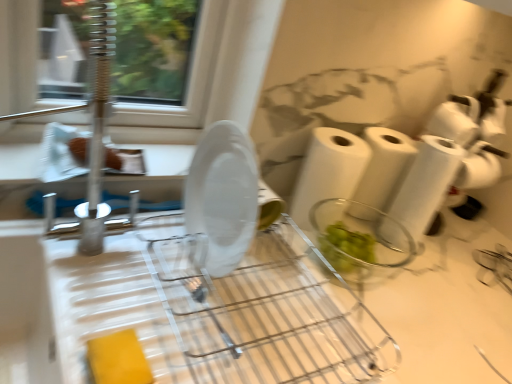
Locate an element on the screen. The image size is (512, 384). white paper towel at center, the 2th paper towel in the left-to-right sequence is located at coordinates (384, 166).

Image resolution: width=512 pixels, height=384 pixels. Describe the element at coordinates (384, 166) in the screenshot. I see `white paper towel at center, which is counted as the 1th paper towel, starting from the right` at that location.

In order to click on white paper towel at right, which ranks as the 2th toilet paper in top-to-bottom order in this screenshot , I will do `click(474, 132)`.

The width and height of the screenshot is (512, 384). What do you see at coordinates (455, 120) in the screenshot?
I see `white matte toilet paper at upper right, the fourth toilet paper ordered from the bottom` at bounding box center [455, 120].

Identify the location of transparent plastic plate at center. The height and width of the screenshot is (384, 512). (219, 290).

This screenshot has width=512, height=384. Describe the element at coordinates (426, 184) in the screenshot. I see `white matte toilet paper at center, marked as the 4th toilet paper in a top-to-bottom arrangement` at that location.

What is the approximate width of white matte toilet paper at center, the first toilet paper positioned from the bottom?

The width of white matte toilet paper at center, the first toilet paper positioned from the bottom, is 11.65 centimeters.

Identify the location of white paper towel at center, placed as the first paper towel when sorted from left to right. The height and width of the screenshot is (384, 512). (328, 171).

Can you tell me how much white matte toilet paper at upper right, the first toilet paper when ordered from top to bottom, and white paper towel at right, arranged as the third toilet paper when ordered from the bottom, differ in facing direction?

43.3 degrees separate the facing orientations of white matte toilet paper at upper right, the first toilet paper when ordered from top to bottom, and white paper towel at right, arranged as the third toilet paper when ordered from the bottom.

The width and height of the screenshot is (512, 384). I want to click on the 1st toilet paper to the right of the white matte toilet paper at upper right, the first toilet paper when ordered from top to bottom, starting your count from the anchor, so click(x=474, y=132).

Is white matte toilet paper at upper right, the first toilet paper when ordered from top to bottom, oriented away from white paper towel at right, which ranks as the 2th toilet paper in top-to-bottom order?

Yes, white matte toilet paper at upper right, the first toilet paper when ordered from top to bottom,'s orientation is away from white paper towel at right, which ranks as the 2th toilet paper in top-to-bottom order.

Does white matte toilet paper at right, which is counted as the 3th toilet paper, starting from the top, have a lesser width compared to white paper towel at center, the 2th paper towel in the left-to-right sequence?

Indeed, white matte toilet paper at right, which is counted as the 3th toilet paper, starting from the top, has a lesser width compared to white paper towel at center, the 2th paper towel in the left-to-right sequence.

From the picture: Is white matte toilet paper at right, which is counted as the second toilet paper, starting from the bottom, to the left or to the right of white paper towel at center, which is counted as the 1th paper towel, starting from the right, in the image?

white matte toilet paper at right, which is counted as the second toilet paper, starting from the bottom, is positioned on white paper towel at center, which is counted as the 1th paper towel, starting from the right,'s right side.

From the image's perspective, who appears lower, white matte toilet paper at right, which is counted as the 3th toilet paper, starting from the top, or white paper towel at center, which is counted as the 1th paper towel, starting from the right?

white paper towel at center, which is counted as the 1th paper towel, starting from the right, is shown below in the image.

Is white matte toilet paper at right, which is counted as the 3th toilet paper, starting from the top, looking in the opposite direction of white paper towel at center, which is counted as the 1th paper towel, starting from the right?

No, white matte toilet paper at right, which is counted as the 3th toilet paper, starting from the top,'s orientation is not away from white paper towel at center, which is counted as the 1th paper towel, starting from the right.

Would you say white matte toilet paper at upper right, the first toilet paper when ordered from top to bottom, is outside white matte toilet paper at right, which is counted as the 3th toilet paper, starting from the top?

Yes.

From the picture: Which is farther, (460, 140) or (479, 185)?

The point (479, 185) is more distant.

From the image's perspective, would you say white matte toilet paper at upper right, the first toilet paper when ordered from top to bottom, is positioned over white matte toilet paper at right, which is counted as the second toilet paper, starting from the bottom?

Yes, from the image's perspective, white matte toilet paper at upper right, the first toilet paper when ordered from top to bottom, is on top of white matte toilet paper at right, which is counted as the second toilet paper, starting from the bottom.

Does white matte toilet paper at upper right, the first toilet paper when ordered from top to bottom, touch white matte toilet paper at right, which is counted as the second toilet paper, starting from the bottom?

There is a gap between white matte toilet paper at upper right, the first toilet paper when ordered from top to bottom, and white matte toilet paper at right, which is counted as the second toilet paper, starting from the bottom.

Is white matte toilet paper at center, the first toilet paper positioned from the bottom, aimed at white paper towel at center, which is counted as the 1th paper towel, starting from the right?

No, white matte toilet paper at center, the first toilet paper positioned from the bottom, is not facing towards white paper towel at center, which is counted as the 1th paper towel, starting from the right.

Is white matte toilet paper at center, marked as the 4th toilet paper in a top-to-bottom arrangement, positioned before white paper towel at center, which is counted as the 1th paper towel, starting from the right?

Yes, it is in front of white paper towel at center, which is counted as the 1th paper towel, starting from the right.

Could you measure the distance between white matte toilet paper at center, the first toilet paper positioned from the bottom, and white paper towel at center, the 2th paper towel in the left-to-right sequence?

They are 2.83 inches apart.

Is white matte toilet paper at center, the first toilet paper positioned from the bottom, to the left of white paper towel at center, which is counted as the 1th paper towel, starting from the right, from the viewer's perspective?

In fact, white matte toilet paper at center, the first toilet paper positioned from the bottom, is to the right of white paper towel at center, which is counted as the 1th paper towel, starting from the right.

From a real-world perspective, does white paper towel at right, arranged as the third toilet paper when ordered from the bottom, stand above white paper towel at center, which is the 2th paper towel in right-to-left order?

Yes, from a real-world perspective, white paper towel at right, arranged as the third toilet paper when ordered from the bottom, is over white paper towel at center, which is the 2th paper towel in right-to-left order

Which of these two, white paper towel at right, which ranks as the 2th toilet paper in top-to-bottom order, or white paper towel at center, placed as the first paper towel when sorted from left to right, is thinner?

white paper towel at center, placed as the first paper towel when sorted from left to right.

From the image's perspective, would you say white paper towel at right, which ranks as the 2th toilet paper in top-to-bottom order, is shown under white paper towel at center, which is the 2th paper towel in right-to-left order?

Incorrect, from the image's perspective, white paper towel at right, which ranks as the 2th toilet paper in top-to-bottom order, is higher than white paper towel at center, which is the 2th paper towel in right-to-left order.

Is the depth of white paper towel at right, which ranks as the 2th toilet paper in top-to-bottom order, less than that of white paper towel at center, placed as the first paper towel when sorted from left to right?

No, the depth of white paper towel at right, which ranks as the 2th toilet paper in top-to-bottom order, is greater than that of white paper towel at center, placed as the first paper towel when sorted from left to right.

Considering the sizes of objects white paper towel at center, placed as the first paper towel when sorted from left to right, and white matte toilet paper at upper right, the fourth toilet paper ordered from the bottom, in the image provided, who is wider, white paper towel at center, placed as the first paper towel when sorted from left to right, or white matte toilet paper at upper right, the fourth toilet paper ordered from the bottom,?

Wider between the two is white matte toilet paper at upper right, the fourth toilet paper ordered from the bottom.

Is point (328, 197) positioned behind point (465, 125)?

That is False.

At what (x,y) coordinates should I click in order to perform the action: click on the 3rd toilet paper behind the white paper towel at center, which is the 2th paper towel in right-to-left order. Please return your answer as a coordinate pair (x, y). Looking at the image, I should click on (455, 120).

Which object is positioned more to the left, white matte toilet paper at center, the first toilet paper positioned from the bottom, or white matte toilet paper at upper right, the fourth toilet paper ordered from the bottom?

Positioned to the left is white matte toilet paper at center, the first toilet paper positioned from the bottom.

Who is smaller, white matte toilet paper at center, the first toilet paper positioned from the bottom, or white matte toilet paper at upper right, the first toilet paper when ordered from top to bottom?

Smaller between the two is white matte toilet paper at upper right, the first toilet paper when ordered from top to bottom.

Between white matte toilet paper at center, marked as the 4th toilet paper in a top-to-bottom arrangement, and white matte toilet paper at upper right, the first toilet paper when ordered from top to bottom, which one has more height?

white matte toilet paper at center, marked as the 4th toilet paper in a top-to-bottom arrangement, is taller.

Is white matte toilet paper at center, the first toilet paper positioned from the bottom, looking in the opposite direction of white matte toilet paper at upper right, the first toilet paper when ordered from top to bottom?

No.

There is a white matte toilet paper at upper right, the fourth toilet paper ordered from the bottom. Where is `the 1st toilet paper below it (from the image's perspective)`? the 1st toilet paper below it (from the image's perspective) is located at coordinates (474, 132).

The image size is (512, 384). I want to click on toilet paper that is the 3rd one above the white paper towel at center, which is counted as the 1th paper towel, starting from the right (from a real-world perspective), so click(479, 167).

Considering their positions, is white paper towel at center, the 2th paper towel in the left-to-right sequence, positioned closer to white paper towel at right, arranged as the third toilet paper when ordered from the bottom, than white matte toilet paper at upper right, the first toilet paper when ordered from top to bottom?

white matte toilet paper at upper right, the first toilet paper when ordered from top to bottom.

When comparing their distances from white paper towel at center, the 2th paper towel in the left-to-right sequence, does white matte toilet paper at upper right, the fourth toilet paper ordered from the bottom, or white paper towel at center, placed as the first paper towel when sorted from left to right, seem further?

white matte toilet paper at upper right, the fourth toilet paper ordered from the bottom, lies further to white paper towel at center, the 2th paper towel in the left-to-right sequence, than the other object.

Based on their spatial positions, is white matte toilet paper at center, the first toilet paper positioned from the bottom, or white paper towel at center, which is counted as the 1th paper towel, starting from the right, further from white paper towel at right, arranged as the third toilet paper when ordered from the bottom?

Based on the image, white paper towel at center, which is counted as the 1th paper towel, starting from the right, appears to be further to white paper towel at right, arranged as the third toilet paper when ordered from the bottom.

Based on their spatial positions, is white matte toilet paper at center, marked as the 4th toilet paper in a top-to-bottom arrangement, or white matte toilet paper at right, which is counted as the second toilet paper, starting from the bottom, further from white matte toilet paper at upper right, the first toilet paper when ordered from top to bottom?

white matte toilet paper at right, which is counted as the second toilet paper, starting from the bottom, is positioned further to the anchor white matte toilet paper at upper right, the first toilet paper when ordered from top to bottom.

From the picture: Looking at the image, which one is located further to white paper towel at center, placed as the first paper towel when sorted from left to right, white matte toilet paper at right, which is counted as the 3th toilet paper, starting from the top, or white paper towel at right, which ranks as the 2th toilet paper in top-to-bottom order?

white matte toilet paper at right, which is counted as the 3th toilet paper, starting from the top, is positioned further to the anchor white paper towel at center, placed as the first paper towel when sorted from left to right.

Considering their positions, is white paper towel at center, which is the 2th paper towel in right-to-left order, positioned further to transparent plastic plate at center than white matte toilet paper at right, which is counted as the 3th toilet paper, starting from the top?

The object further to transparent plastic plate at center is white matte toilet paper at right, which is counted as the 3th toilet paper, starting from the top.

Considering their positions, is white matte toilet paper at upper right, the fourth toilet paper ordered from the bottom, positioned further to white matte toilet paper at right, which is counted as the 3th toilet paper, starting from the top, than white paper towel at center, which is the 2th paper towel in right-to-left order?

Based on the image, white paper towel at center, which is the 2th paper towel in right-to-left order, appears to be further to white matte toilet paper at right, which is counted as the 3th toilet paper, starting from the top.

Considering their positions, is white paper towel at center, the 2th paper towel in the left-to-right sequence, positioned closer to white matte toilet paper at upper right, the fourth toilet paper ordered from the bottom, than white matte toilet paper at right, which is counted as the 3th toilet paper, starting from the top?

white paper towel at center, the 2th paper towel in the left-to-right sequence, lies closer to white matte toilet paper at upper right, the fourth toilet paper ordered from the bottom, than the other object.

The image size is (512, 384). In order to click on toilet paper between white matte toilet paper at upper right, the first toilet paper when ordered from top to bottom, and white matte toilet paper at right, which is counted as the second toilet paper, starting from the bottom, in the up-down direction in this screenshot , I will do `click(474, 132)`.

Find the location of a particular element. The height and width of the screenshot is (384, 512). paper towel positioned between transparent plastic plate at center and white paper towel at center, the 2th paper towel in the left-to-right sequence, from near to far is located at coordinates (328, 171).

The height and width of the screenshot is (384, 512). I want to click on paper towel between white paper towel at center, which is the 2th paper towel in right-to-left order, and white matte toilet paper at upper right, the fourth toilet paper ordered from the bottom, so click(384, 166).

Identify the location of paper towel between white paper towel at center, which is the 2th paper towel in right-to-left order, and white matte toilet paper at center, marked as the 4th toilet paper in a top-to-bottom arrangement. (384, 166).